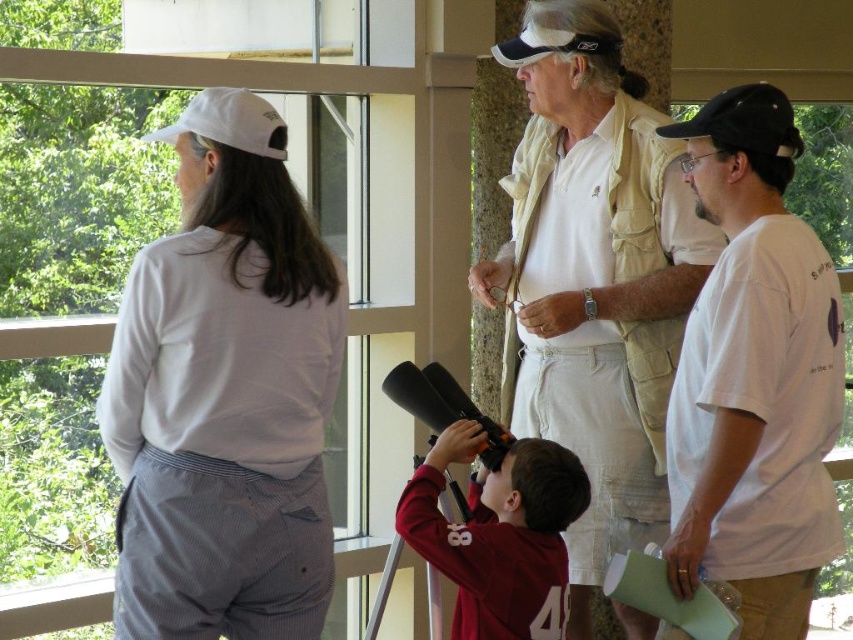
Question: Which of the following is the farthest from the observer?

Choices:
 (A) (676, 550)
 (B) (206, 104)
 (C) (450, 548)

Answer: (C)

Question: From the image, what is the correct spatial relationship of black fabric baseball cap at upper right in relation to white fabric baseball cap at upper left?

Choices:
 (A) above
 (B) below

Answer: (A)

Question: Which point is closer to the camera?

Choices:
 (A) white cotton t-shirt at right
 (B) white fabric baseball cap at upper left
 (C) black fabric baseball cap at upper right

Answer: (A)

Question: Is white cotton shirt at upper left smaller than white cotton t-shirt at right?

Choices:
 (A) yes
 (B) no

Answer: (A)

Question: Can you confirm if white cotton t-shirt at right is positioned to the left of white fabric baseball cap at upper left?

Choices:
 (A) yes
 (B) no

Answer: (B)

Question: Which point appears farthest from the camera in this image?

Choices:
 (A) (465, 557)
 (B) (755, 125)
 (C) (218, 118)
 (D) (292, 333)

Answer: (A)